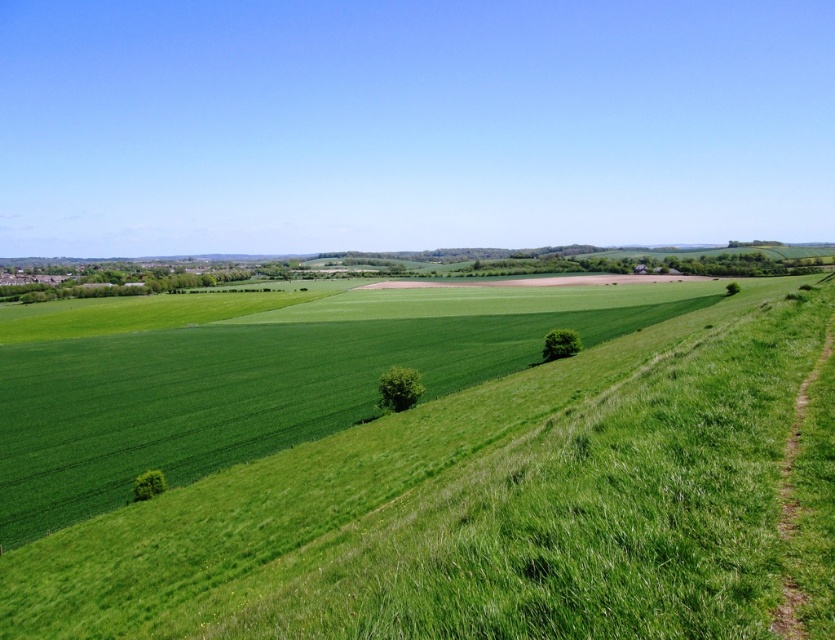
You are standing on the path along the right side of the hill and want to walk towards the green leafy tree at lower right and the green leafy tree at lower left. Which tree will you reach first?

The green leafy tree at lower right is closer to you than the green leafy tree at lower left, so you will reach the green leafy tree at lower right first.

You are standing at the bottom of the hill and want to reach the green leafy tree at center. The path on the right side of the hill is 150 feet long. Can you walk directly to the tree along the path without needing to go around?

The distance between you and the green leafy tree at center is 175.50 feet, while the path is only 150 feet long. Therefore, you cannot reach the tree directly along the path and would need to go around or take another route.

You are standing on the path along the right side of the hill and want to walk towards the green leafy tree at center. Which direction should you go relative to the green leafy tree at lower right?

You should walk towards the green leafy tree at center by moving in the direction below the green leafy tree at lower right, since the green leafy tree at center is positioned below it.